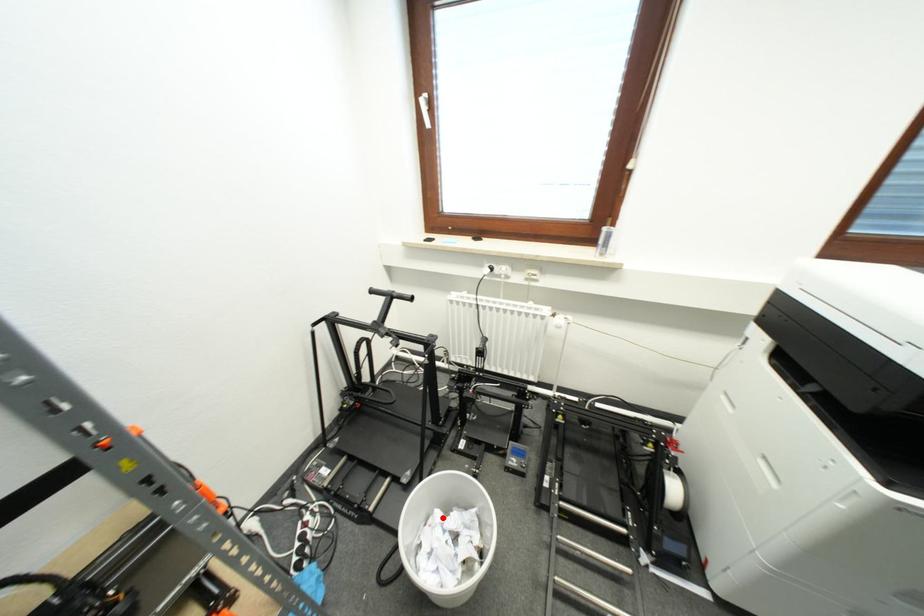
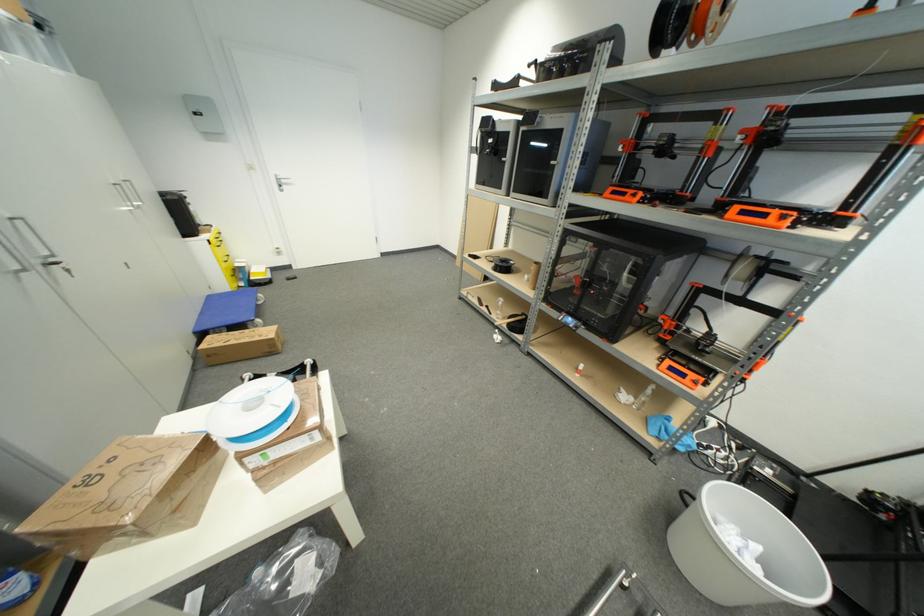
Question: I am providing you with two images of the same scene from different viewpoints. A red point is shown in image1. For the corresponding object point in image2, is it positioned nearer or farther from the camera?

Choices:
 (A) Nearer
 (B) Farther

Answer: (B)